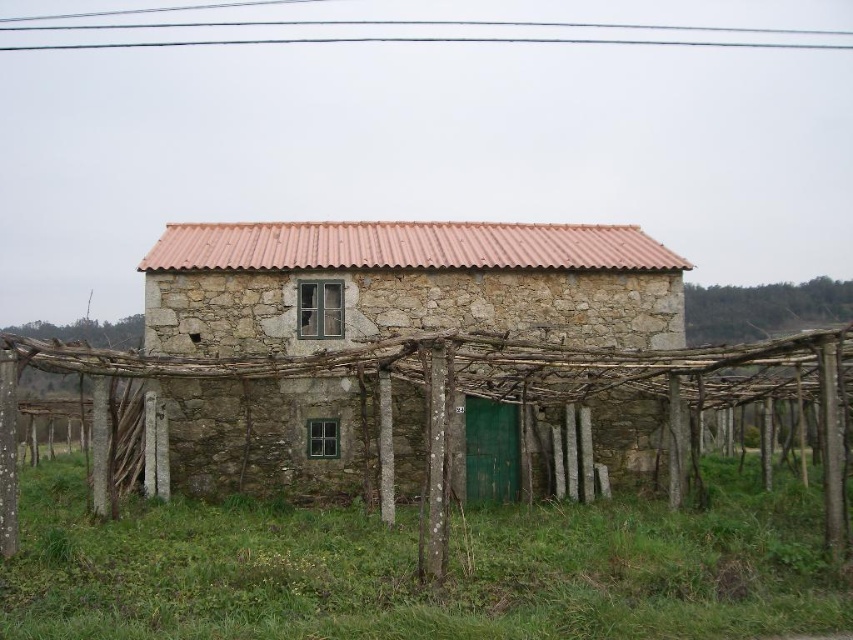
Measure the distance from rustic stone barn at center to brown wooden trellis at center.

5.64 feet

Identify the location of rustic stone barn at center. (405, 285).

Where is `rustic stone barn at center`? rustic stone barn at center is located at coordinates (405, 285).